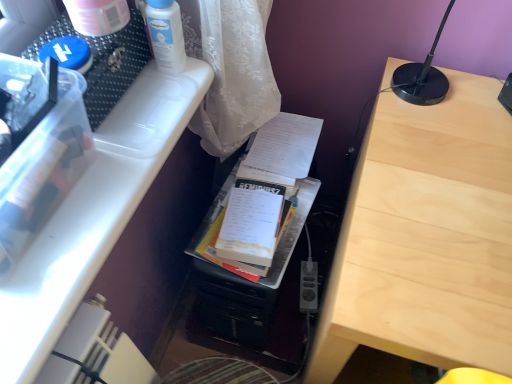
In order to click on vacant region above light wood table at center (from a real-world perspective) in this screenshot , I will do `click(455, 178)`.